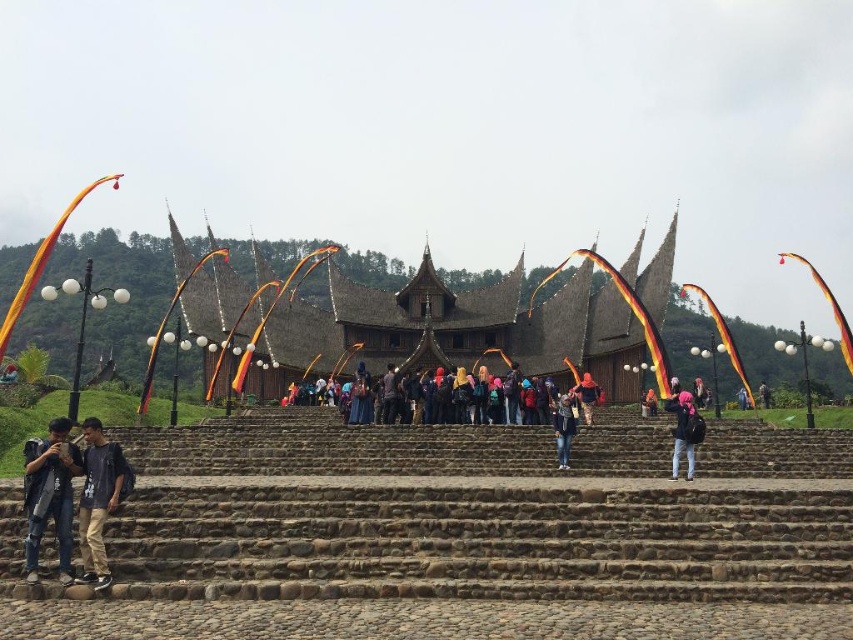
You are a visitor standing at the bottom of the staircase in front of the traditional building. You notice the brown thatched roof at center and the denim jacket at lower left. Which object is taller?

The brown thatched roof at center is much taller than the denim jacket at lower left.

You are standing at the bottom of the staircase in front of the traditional building. You see the dark gray fabric pants at lower left and the camouflage jacket at center. Which object is positioned more to the left side of the staircase?

The dark gray fabric pants at lower left is positioned more to the left side of the staircase than the camouflage jacket at center.